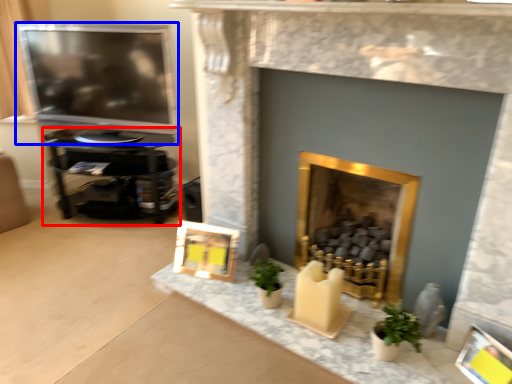
Question: Among these objects, which one is nearest to the camera, furniture (highlighted by a red box) or television (highlighted by a blue box)?

Choices:
 (A) furniture
 (B) television

Answer: (B)